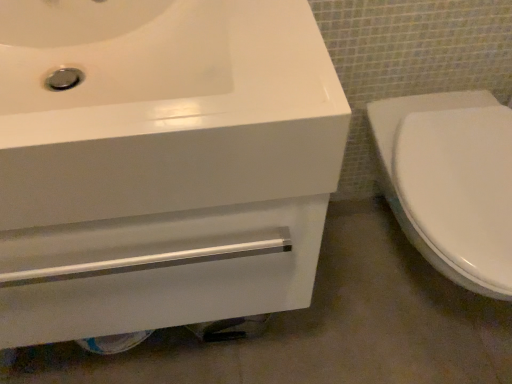
Question: From a real-world perspective, is white glossy toilet at right above or below white glossy drawer at lower left?

Choices:
 (A) above
 (B) below

Answer: (A)

Question: Based on their sizes in the image, would you say white glossy toilet at right is bigger or smaller than white glossy drawer at lower left?

Choices:
 (A) small
 (B) big

Answer: (B)

Question: Considering the real-world distances, which object is farthest from the white glossy sink at upper left?

Choices:
 (A) white glossy toilet at right
 (B) white glossy drawer at lower left

Answer: (A)

Question: Which is farther from the white glossy toilet at right?

Choices:
 (A) white glossy drawer at lower left
 (B) white glossy sink at upper left

Answer: (B)